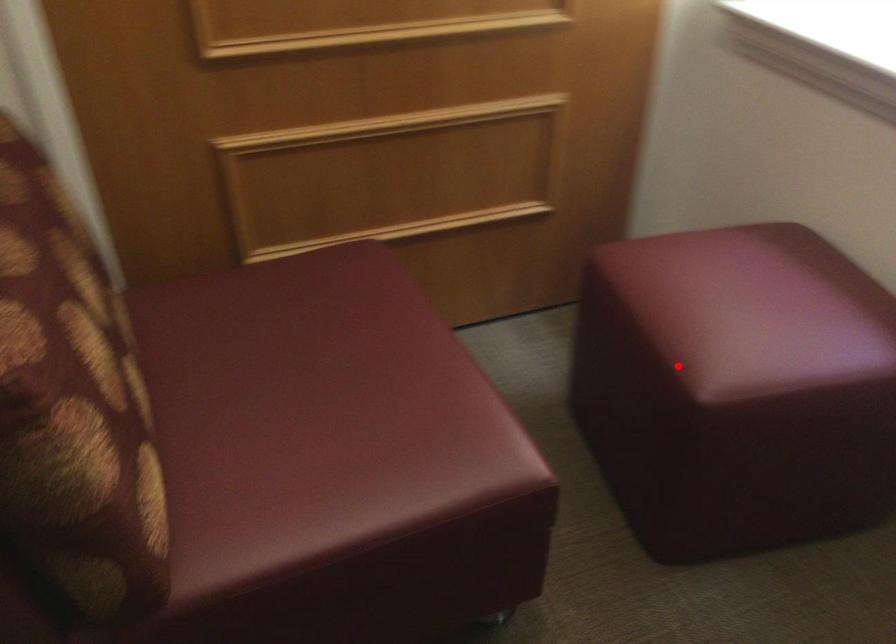
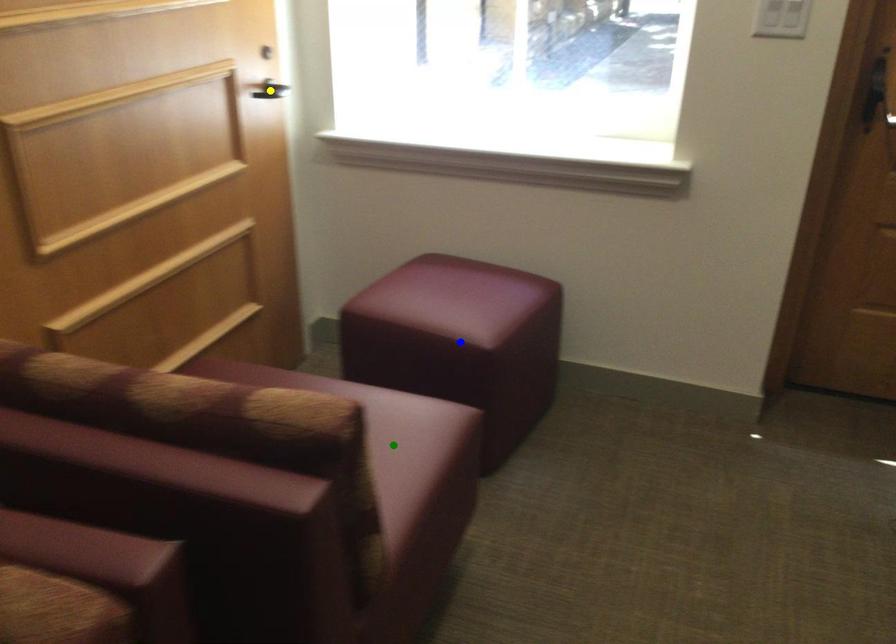
Question: I am providing you with two images of the same scene from different viewpoints. A red point is marked on the first image. You are given multiple points on the second image. Which spot in image 2 lines up with the point in image 1?

Choices:
 (A) yellow point
 (B) green point
 (C) blue point

Answer: (C)